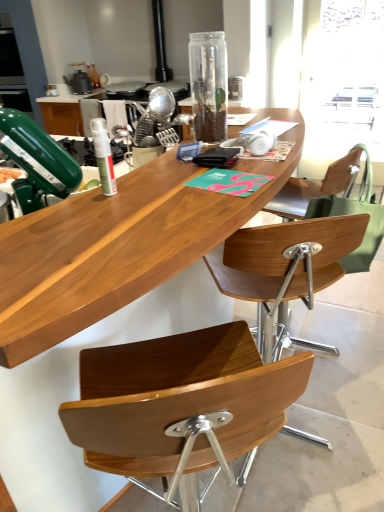
You are a GUI agent. You are given a task and a screenshot of the screen. Output one action in this format:
    pyautogui.click(x=<x>, y=<y>)
    Task: Click on the white matte spray can at center, which appears as the 1th bottle when viewed from the front
    The height and width of the screenshot is (512, 384).
    Given the screenshot: What is the action you would take?
    pyautogui.click(x=103, y=156)

What do you see at coordinates (107, 294) in the screenshot?
I see `wooden desk at center` at bounding box center [107, 294].

Consider the image. How much space does transparent glass bottle at center, placed as the first bottle when sorted from back to front, occupy vertically?

The height of transparent glass bottle at center, placed as the first bottle when sorted from back to front, is 13.60 inches.

You are a GUI agent. You are given a task and a screenshot of the screen. Output one action in this format:
    pyautogui.click(x=<x>, y=<y>)
    Task: Click on the metallic silver whisk at center, which is the first appliance from front to back
    The height and width of the screenshot is (512, 384).
    Given the screenshot: What is the action you would take?
    pyautogui.click(x=156, y=112)

Does transparent plastic window screen at upper right come in front of matte black kettle at upper left, marked as the first appliance in a left-to-right arrangement?

Yes, transparent plastic window screen at upper right is closer to the viewer.

From a real-world perspective, is transparent plastic window screen at upper right under matte black kettle at upper left, marked as the 1th appliance in a top-to-bottom arrangement?

Indeed, from a real-world perspective, transparent plastic window screen at upper right is positioned beneath matte black kettle at upper left, marked as the 1th appliance in a top-to-bottom arrangement.

Identify the location of window screen on the right of matte black kettle at upper left, which appears as the 2th appliance when viewed from the right. Image resolution: width=384 pixels, height=512 pixels. 343,84.

From the image's perspective, is metallic silver whisk at center, arranged as the second appliance when viewed from the left, above transparent glass bottle at center, the first bottle from the right?

Actually, metallic silver whisk at center, arranged as the second appliance when viewed from the left, appears below transparent glass bottle at center, the first bottle from the right, in the image.

Which of these two, metallic silver whisk at center, the first appliance in the bottom-to-top sequence, or transparent glass bottle at center, the second bottle viewed from the left, is bigger?

Bigger between the two is metallic silver whisk at center, the first appliance in the bottom-to-top sequence.

In the image, is metallic silver whisk at center, arranged as the second appliance when viewed from the left, on the left side or the right side of transparent glass bottle at center, which ranks as the second bottle in bottom-to-top order?

metallic silver whisk at center, arranged as the second appliance when viewed from the left, is positioned on transparent glass bottle at center, which ranks as the second bottle in bottom-to-top order,'s left side.

From a real-world perspective, is metallic silver whisk at center, which is counted as the first appliance, starting from the right, physically located above or below transparent glass bottle at center, the second bottle viewed from the left?

From a real-world perspective, metallic silver whisk at center, which is counted as the first appliance, starting from the right, is physically below transparent glass bottle at center, the second bottle viewed from the left.

In the scene shown: Is matte black kettle at upper left, the second appliance positioned from the bottom, positioned with its back to metallic silver whisk at center, arranged as the second appliance when viewed from the left?

No, metallic silver whisk at center, arranged as the second appliance when viewed from the left, is not at the back of matte black kettle at upper left, the second appliance positioned from the bottom.

Is matte black kettle at upper left, placed as the 1th appliance when sorted from back to front, positioned behind metallic silver whisk at center, which is the first appliance from front to back?

Yes, matte black kettle at upper left, placed as the 1th appliance when sorted from back to front, is behind metallic silver whisk at center, which is the first appliance from front to back.

Identify the location of appliance in front of the matte black kettle at upper left, marked as the first appliance in a left-to-right arrangement. (156, 112).

From a real-world perspective, is matte black kettle at upper left, placed as the 1th appliance when sorted from back to front, under metallic silver whisk at center, acting as the second appliance starting from the back?

Indeed, from a real-world perspective, matte black kettle at upper left, placed as the 1th appliance when sorted from back to front, is positioned beneath metallic silver whisk at center, acting as the second appliance starting from the back.

From a real-world perspective, between transparent glass bottle at center, placed as the first bottle when sorted from back to front, and white matte spray can at center, placed as the 1th bottle when sorted from left to right, who is vertically lower?

From a 3D spatial view, white matte spray can at center, placed as the 1th bottle when sorted from left to right, is below.

Can you confirm if transparent glass bottle at center, acting as the first bottle starting from the top, is bigger than white matte spray can at center, arranged as the first bottle when ordered from the bottom?

Yes.

In terms of width, does transparent glass bottle at center, the first bottle from the right, look wider or thinner when compared to white matte spray can at center, which appears as the 1th bottle when viewed from the front?

transparent glass bottle at center, the first bottle from the right, is wider than white matte spray can at center, which appears as the 1th bottle when viewed from the front.

From the picture: Which is correct: transparent glass bottle at center, acting as the first bottle starting from the top, is inside white matte spray can at center, arranged as the first bottle when ordered from the bottom, or outside of it?

transparent glass bottle at center, acting as the first bottle starting from the top, is spatially situated outside white matte spray can at center, arranged as the first bottle when ordered from the bottom.

Is wooden desk at center far from matte black kettle at upper left, which appears as the 2th appliance when viewed from the right?

wooden desk at center is positioned a significant distance from matte black kettle at upper left, which appears as the 2th appliance when viewed from the right.

From the image's perspective, relative to matte black kettle at upper left, the second appliance from the front, is wooden desk at center above or below?

wooden desk at center is situated lower than matte black kettle at upper left, the second appliance from the front, in the image.

Is wooden desk at center in front of matte black kettle at upper left, which appears as the 2th appliance when viewed from the right?

Yes, wooden desk at center is closer to the viewer.

Is wooden desk at center aimed at matte black kettle at upper left, placed as the 1th appliance when sorted from back to front?

No, wooden desk at center is not aimed at matte black kettle at upper left, placed as the 1th appliance when sorted from back to front.

Consider the image. Considering the sizes of objects white paper towel at upper center and matte black kettle at upper left, placed as the 1th appliance when sorted from back to front, in the image provided, who is shorter, white paper towel at upper center or matte black kettle at upper left, placed as the 1th appliance when sorted from back to front,?

Standing shorter between the two is matte black kettle at upper left, placed as the 1th appliance when sorted from back to front.

How many degrees apart are the facing directions of white paper towel at upper center and matte black kettle at upper left, placed as the 1th appliance when sorted from back to front?

The facing directions of white paper towel at upper center and matte black kettle at upper left, placed as the 1th appliance when sorted from back to front, are 40.6 degrees apart.

Could you measure the distance between white paper towel at upper center and matte black kettle at upper left, the second appliance positioned from the bottom?

They are 2.16 meters apart.

Would you say white paper towel at upper center contains matte black kettle at upper left, placed as the 1th appliance when sorted from back to front?

No, matte black kettle at upper left, placed as the 1th appliance when sorted from back to front, is not surrounded by white paper towel at upper center.

Image resolution: width=384 pixels, height=512 pixels. In order to click on towel/napkin that is under the green fabric handbag at right (from a real-world perspective) in this screenshot , I will do point(114,114).

Would you say green fabric handbag at right is part of white paper towel at upper center's contents?

No, white paper towel at upper center does not contain green fabric handbag at right.

Is white paper towel at upper center facing away from green fabric handbag at right?

No.

Is white paper towel at upper center next to green fabric handbag at right and touching it?

white paper towel at upper center and green fabric handbag at right are not in contact.

Where is `window screen below the matte black kettle at upper left, marked as the first appliance in a left-to-right arrangement (from a real-world perspective)`? window screen below the matte black kettle at upper left, marked as the first appliance in a left-to-right arrangement (from a real-world perspective) is located at coordinates (343, 84).

This screenshot has width=384, height=512. I want to click on bottle on the right side of metallic silver whisk at center, which is counted as the first appliance, starting from the right, so click(209, 85).

Based on their spatial positions, is transparent plastic window screen at upper right or green fabric handbag at right further from transparent glass bottle at center, acting as the first bottle starting from the top?

green fabric handbag at right lies further to transparent glass bottle at center, acting as the first bottle starting from the top, than the other object.

Estimate the real-world distances between objects in this image. Which object is closer to wooden desk at center, matte black kettle at upper left, the second appliance from the front, or white paper towel at upper center?

white paper towel at upper center.

Which object lies further to the anchor point metallic silver whisk at center, arranged as the second appliance when viewed from the left, white matte spray can at center, which ranks as the second bottle in back-to-front order, or wooden chair at center?

Among the two, wooden chair at center is located further to metallic silver whisk at center, arranged as the second appliance when viewed from the left.

Based on their spatial positions, is green fabric handbag at right or wooden chair at center closer to white matte spray can at center, the second bottle when ordered from top to bottom?

wooden chair at center lies closer to white matte spray can at center, the second bottle when ordered from top to bottom, than the other object.

Which object lies further to the anchor point white matte spray can at center, the 2th bottle from the right, transparent plastic window screen at upper right or white paper towel at upper center?

transparent plastic window screen at upper right is further to white matte spray can at center, the 2th bottle from the right.

Based on their spatial positions, is green fabric handbag at right or wooden chair at center closer to transparent glass bottle at center, which is the second bottle in front-to-back order?

Based on the image, green fabric handbag at right appears to be nearer to transparent glass bottle at center, which is the second bottle in front-to-back order.

Looking at the image, which one is located further to wooden chair at center, metallic silver whisk at center, which is the 2th appliance from top to bottom, or transparent glass bottle at center, which ranks as the second bottle in bottom-to-top order?

transparent glass bottle at center, which ranks as the second bottle in bottom-to-top order.

When comparing their distances from white paper towel at upper center, does matte black kettle at upper left, marked as the first appliance in a left-to-right arrangement, or transparent glass bottle at center, which is the second bottle in front-to-back order, seem closer?

The object closer to white paper towel at upper center is transparent glass bottle at center, which is the second bottle in front-to-back order.

Find the location of a particular element. This screenshot has height=512, width=384. bottle between white matte spray can at center, arranged as the first bottle when ordered from the bottom, and matte black kettle at upper left, placed as the 1th appliance when sorted from back to front, along the z-axis is located at coordinates (209, 85).

The image size is (384, 512). I want to click on window screen located between transparent glass bottle at center, the second bottle viewed from the left, and white paper towel at upper center in the depth direction, so click(343, 84).

This screenshot has width=384, height=512. I want to click on appliance between white matte spray can at center, which appears as the 1th bottle when viewed from the front, and transparent plastic window screen at upper right, along the z-axis, so click(x=156, y=112).

Where is `bottle between white matte spray can at center, the second bottle when ordered from top to bottom, and transparent plastic window screen at upper right in the front-back direction`? The height and width of the screenshot is (512, 384). bottle between white matte spray can at center, the second bottle when ordered from top to bottom, and transparent plastic window screen at upper right in the front-back direction is located at coordinates [x=209, y=85].